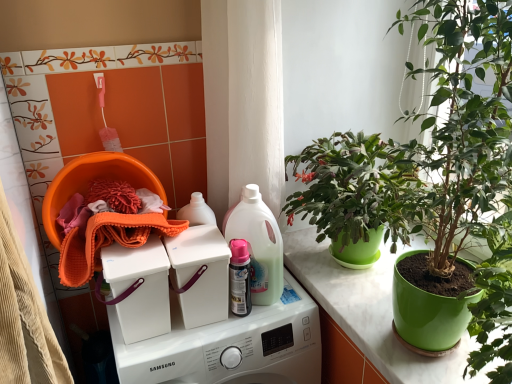
Question: Is translucent plastic spray bottle at center next to orange microfiber cloth at left and touching it?

Choices:
 (A) no
 (B) yes

Answer: (A)

Question: From the image's perspective, is translucent plastic spray bottle at center located beneath orange microfiber cloth at left?

Choices:
 (A) no
 (B) yes

Answer: (B)

Question: Does translucent plastic spray bottle at center have a greater height compared to orange microfiber cloth at left?

Choices:
 (A) no
 (B) yes

Answer: (B)

Question: Is translucent plastic spray bottle at center not near orange microfiber cloth at left?

Choices:
 (A) yes
 (B) no

Answer: (B)

Question: Is orange microfiber cloth at left surrounded by translucent plastic spray bottle at center?

Choices:
 (A) yes
 (B) no

Answer: (B)

Question: From the image's perspective, is pink glossy spray can at center located above or below green matte plant pot at center?

Choices:
 (A) below
 (B) above

Answer: (B)

Question: Is pink glossy spray can at center to the left or to the right of green matte plant pot at center in the image?

Choices:
 (A) left
 (B) right

Answer: (A)

Question: From a real-world perspective, relative to green matte plant pot at center, is pink glossy spray can at center vertically above or below?

Choices:
 (A) below
 (B) above

Answer: (B)

Question: In terms of height, does pink glossy spray can at center look taller or shorter compared to green matte plant pot at center?

Choices:
 (A) tall
 (B) short

Answer: (A)

Question: Which is correct: translucent plastic spray bottle at center is inside white plastic washing machine at center, the first washing machine viewed from the top, or outside of it?

Choices:
 (A) inside
 (B) outside

Answer: (B)

Question: Considering their positions, is translucent plastic spray bottle at center located in front of or behind white plastic washing machine at center, which ranks as the second washing machine in bottom-to-top order?

Choices:
 (A) front
 (B) behind

Answer: (B)

Question: Is translucent plastic spray bottle at center wider or thinner than white plastic washing machine at center, which ranks as the second washing machine in bottom-to-top order?

Choices:
 (A) thin
 (B) wide

Answer: (B)

Question: Is translucent plastic spray bottle at center taller or shorter than white plastic washing machine at center, which ranks as the second washing machine in bottom-to-top order?

Choices:
 (A) tall
 (B) short

Answer: (A)

Question: From the image's perspective, relative to translucent plastic spray bottle at center, is white plastic washing machine at center, which ranks as the second washing machine in bottom-to-top order, above or below?

Choices:
 (A) below
 (B) above

Answer: (A)

Question: From a real-world perspective, is white plastic washing machine at center, which ranks as the second washing machine in bottom-to-top order, positioned above or below translucent plastic spray bottle at center?

Choices:
 (A) below
 (B) above

Answer: (A)